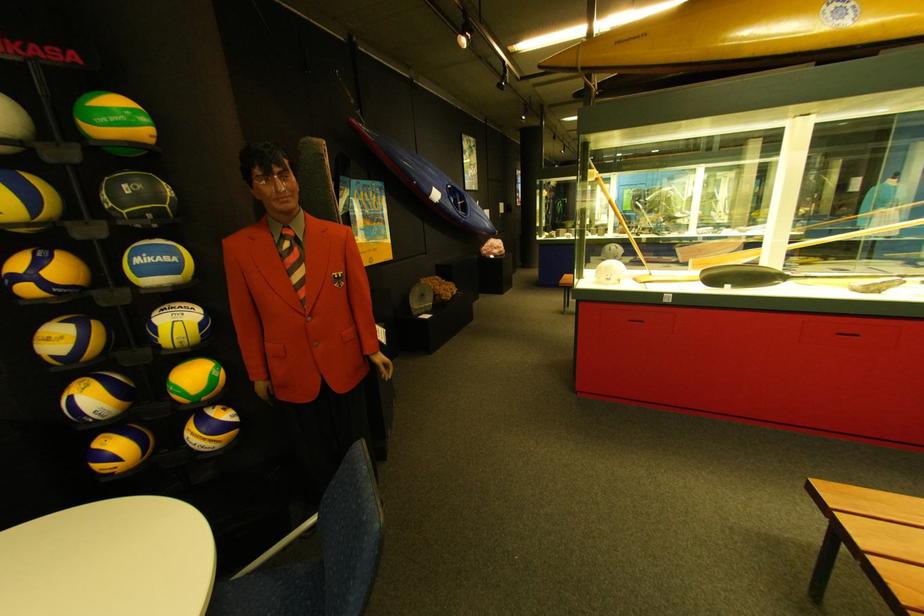
Find the location of a particular element. blue and white volleyball is located at coordinates (157, 264).